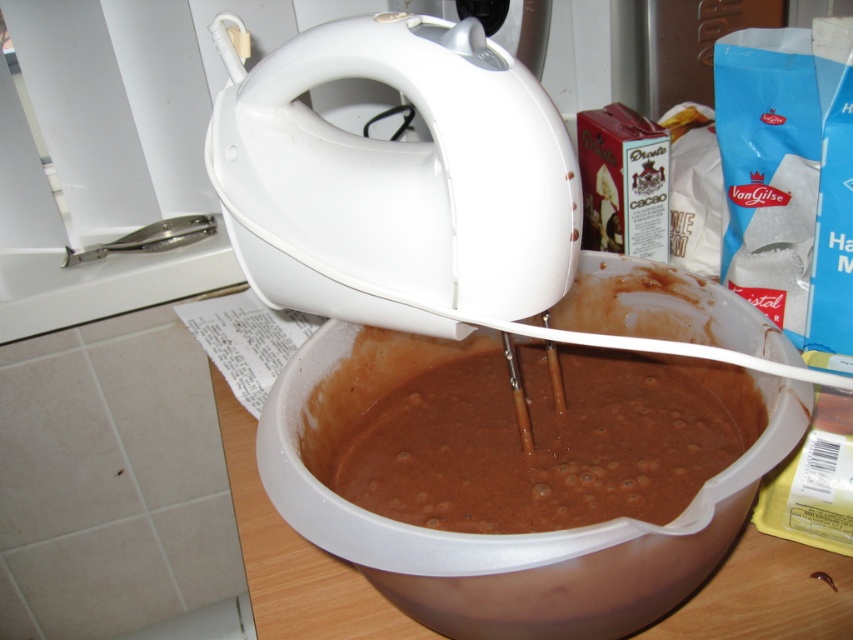
Is white plastic mixer at upper center thinner than brown matte plastic bowl at center?

Yes.

Is point (492, 84) closer to camera compared to point (780, 385)?

Yes, point (492, 84) is closer to viewer.

Where is `white plastic mixer at upper center`? The width and height of the screenshot is (853, 640). white plastic mixer at upper center is located at coordinates point(396,179).

Between brown matte plastic bowl at center and chocolate matte batter at center, which one is positioned lower?

brown matte plastic bowl at center is lower down.

Between point (314, 508) and point (595, 496), which one is positioned in front?

Point (314, 508) is more forward.

Measure the distance between point [346,504] and camera.

The distance of point [346,504] from camera is 35.42 centimeters.

Where is `brown matte plastic bowl at center`? brown matte plastic bowl at center is located at coordinates (497, 534).

Who is lower down, white plastic mixer at upper center or chocolate matte batter at center?

chocolate matte batter at center is below.

Does white plastic mixer at upper center appear on the right side of chocolate matte batter at center?

In fact, white plastic mixer at upper center is to the left of chocolate matte batter at center.

Does point (312, 241) lie behind point (340, 477)?

No, it is not.

Locate an element on the screen. white plastic mixer at upper center is located at coordinates (396, 179).